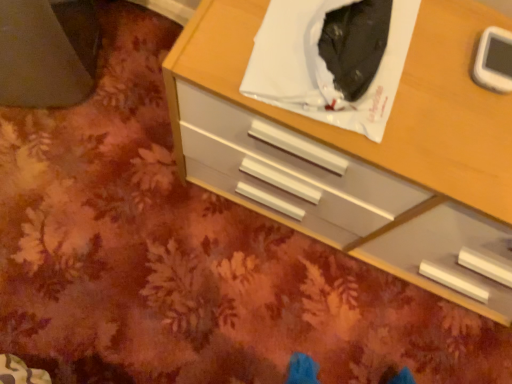
Where is `wooden chest of drawers at upper center`? This screenshot has height=384, width=512. wooden chest of drawers at upper center is located at coordinates (362, 146).

Describe the element at coordinates (362, 146) in the screenshot. Image resolution: width=512 pixels, height=384 pixels. I see `wooden chest of drawers at upper center` at that location.

Image resolution: width=512 pixels, height=384 pixels. What are the coordinates of `wooden chest of drawers at upper center` in the screenshot? It's located at (362, 146).